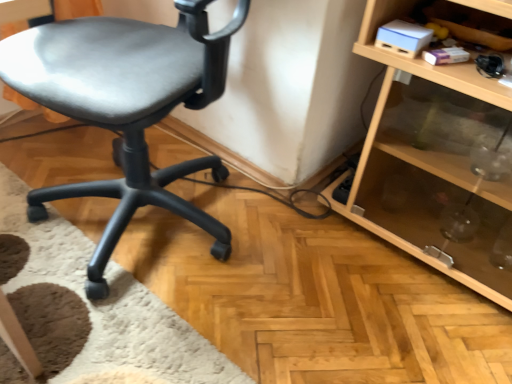
The height and width of the screenshot is (384, 512). In order to click on free location in front of transparent glass shelf at lower right in this screenshot , I will do `click(401, 324)`.